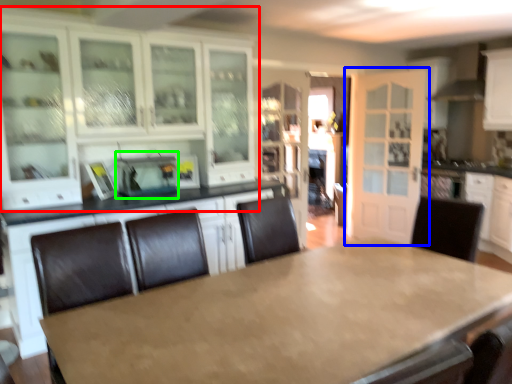
Question: Which object is the farthest from cabinetry (highlighted by a red box)? Choose among these: door (highlighted by a blue box) or appliance (highlighted by a green box).

Choices:
 (A) door
 (B) appliance

Answer: (A)